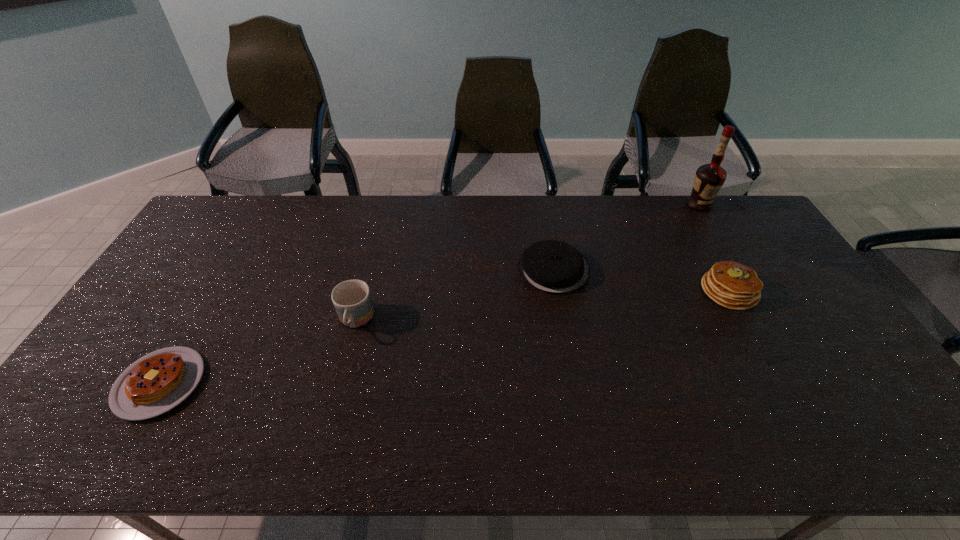
Identify the location of free space located on the front and back of the farthest object. (736, 268).

I want to click on vacant space located 0.210m on the side with the handle of the second tallest object, so click(x=332, y=412).

You are a GUI agent. You are given a task and a screenshot of the screen. Output one action in this format:
    pyautogui.click(x=<x>, y=<y>)
    Task: Click on the vacant space located on the left of the tallest pancake
    The width and height of the screenshot is (960, 540).
    Given the screenshot: What is the action you would take?
    pyautogui.click(x=587, y=291)

Where is `free spot located 0.270m on the left of the second pancake from left to right`? This screenshot has height=540, width=960. free spot located 0.270m on the left of the second pancake from left to right is located at coordinates (434, 269).

The width and height of the screenshot is (960, 540). In order to click on free space located 0.320m on the right of the shortest pancake in this screenshot , I will do `click(329, 383)`.

Locate an element on the screen. The image size is (960, 540). object that is at the far edge is located at coordinates (709, 178).

In order to click on object positioned at the near edge in this screenshot , I will do point(157,382).

Where is `object positioned at the left edge`? This screenshot has width=960, height=540. object positioned at the left edge is located at coordinates (157, 382).

Locate an element on the screen. The width and height of the screenshot is (960, 540). liquor at the right edge is located at coordinates 709,178.

At what (x,y) coordinates should I click in order to perform the action: click on pancake that is at the right edge. Please return your answer as a coordinate pair (x, y). Image resolution: width=960 pixels, height=540 pixels. Looking at the image, I should click on (730, 284).